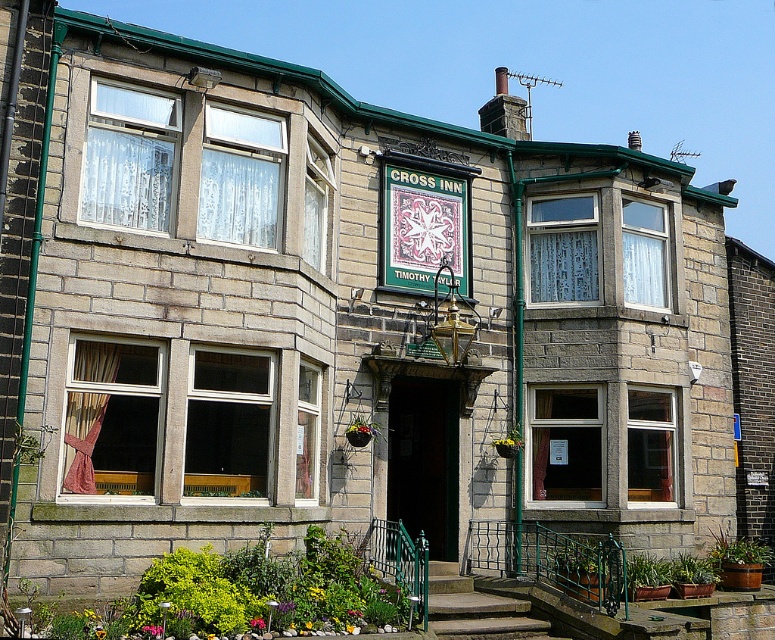
You are standing in front of the two story stone building and want to determine which of the two points, point (443, 209) or point (484, 618), is closer to you. Which one is closer?

Point (443, 209) is closer to you because it is further to the viewer than point (484, 618).

You are a delivery person approaching the pub and need to locate the entrance. The green fabric sign at center and the concrete steps at center are both visible. Which one is larger in size?

The green fabric sign at center is bigger than the concrete steps at center, so the sign is larger in size.

You are a delivery person trying to deliver a package to the pub. The entrance is at the center of the building. You see the green fabric sign at center and concrete steps at center. Which object is closer to the entrance?

The concrete steps at center are closer to the entrance because the green fabric sign at center is taller than the concrete steps at center, indicating that the sign is above the steps.